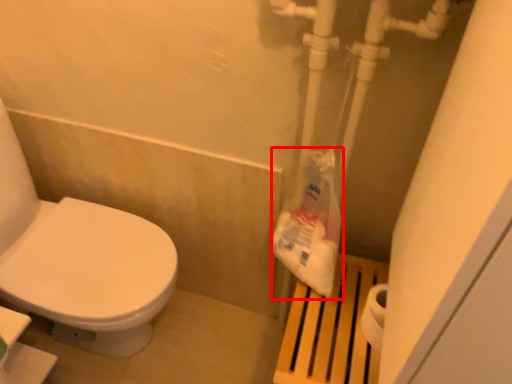
Question: In this image, where is paper bag (annotated by the red box) located relative to step stool?

Choices:
 (A) right
 (B) left

Answer: (B)